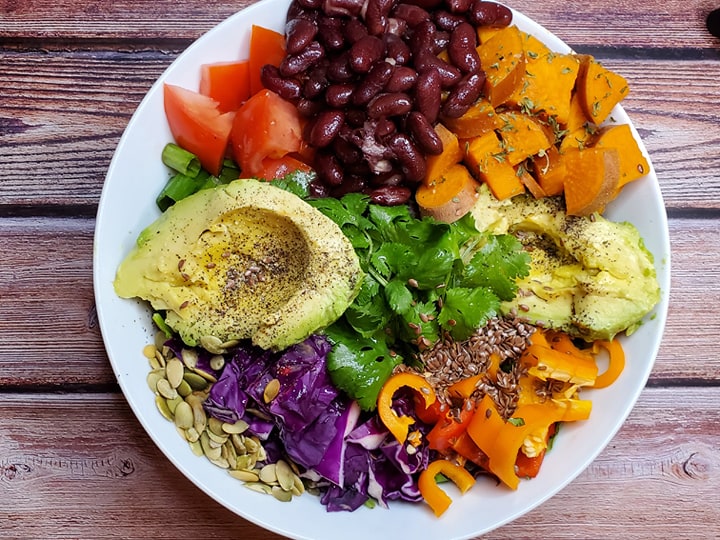
Point to visible what plate sets on in the image. Your answer should be formatted as a list of tuples, i.e. [(x1, y1), (x2, y2), ...], where each tuple contains the x and y coordinates of a point satisfying the conditions above.

[(639, 492)]